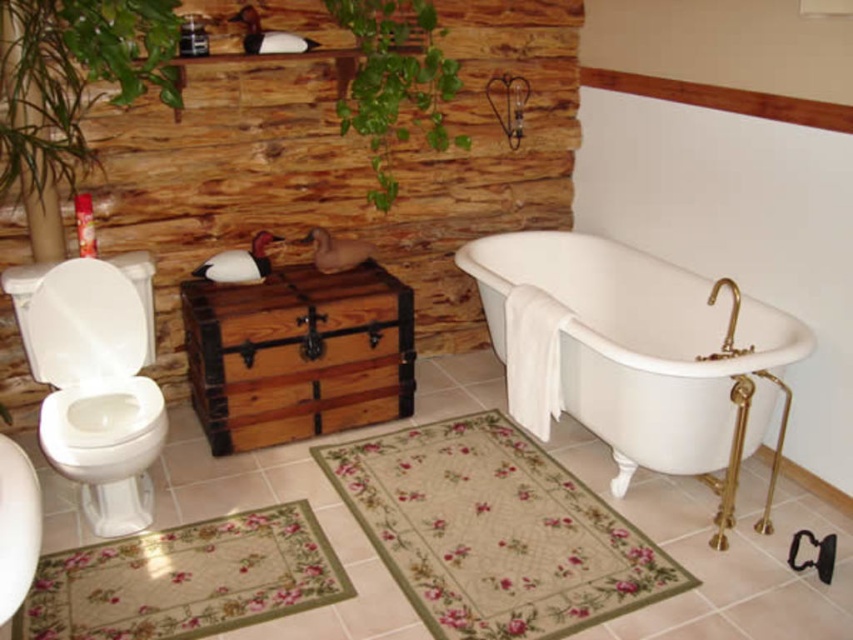
Question: Based on their relative distances, which object is nearer to the green leafy plant at upper left?

Choices:
 (A) white porcelain bathtub at center
 (B) white glossy sink at lower left
 (C) floral carpet at lower left
 (D) white glossy toilet bowl at left

Answer: (D)

Question: Does floral carpet at lower center lie behind white glossy toilet bowl at lower left?

Choices:
 (A) yes
 (B) no

Answer: (B)

Question: Which point is closer to the camera?

Choices:
 (A) (106, 376)
 (B) (405, 58)

Answer: (A)

Question: Can you confirm if floral carpet at lower center is wider than white glossy sink at lower left?

Choices:
 (A) yes
 (B) no

Answer: (A)

Question: Can you confirm if white porcelain bathtub at center is smaller than white glossy toilet bowl at left?

Choices:
 (A) no
 (B) yes

Answer: (A)

Question: Estimate the real-world distances between objects in this image. Which object is farther from the white glossy toilet bowl at left?

Choices:
 (A) white glossy toilet bowl at lower left
 (B) green leafy plant at upper left
 (C) green leafy plant at upper center
 (D) white porcelain bathtub at center

Answer: (D)